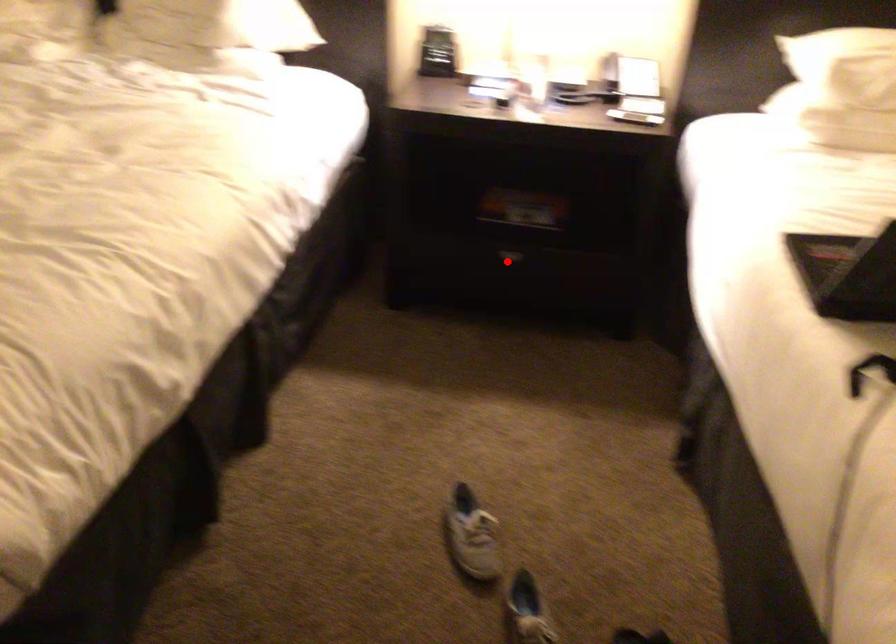
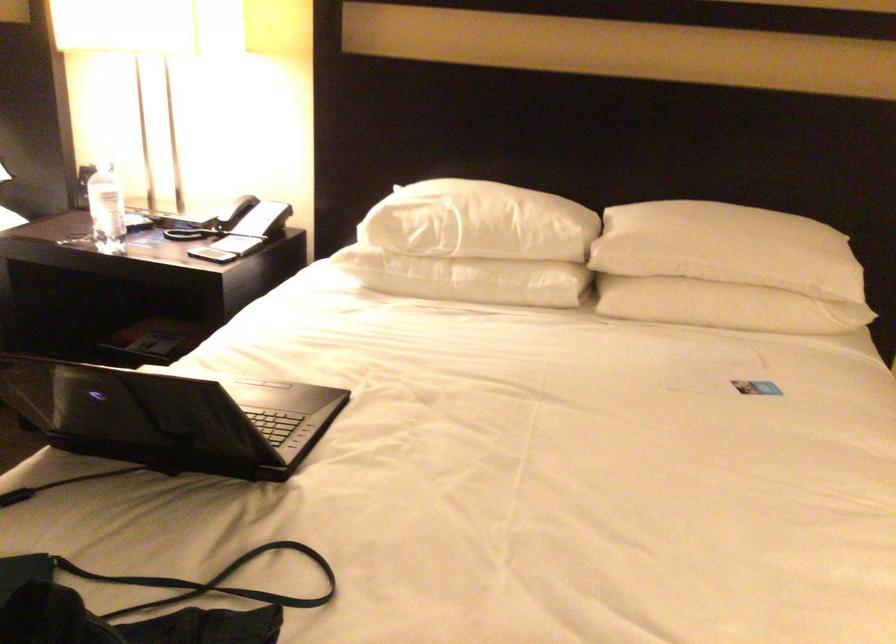
Question: I am providing you with two images of the same scene from different viewpoints. A red point is marked on the first image. Can you still see the location of the red point in image 2?

Choices:
 (A) Yes
 (B) No

Answer: (B)